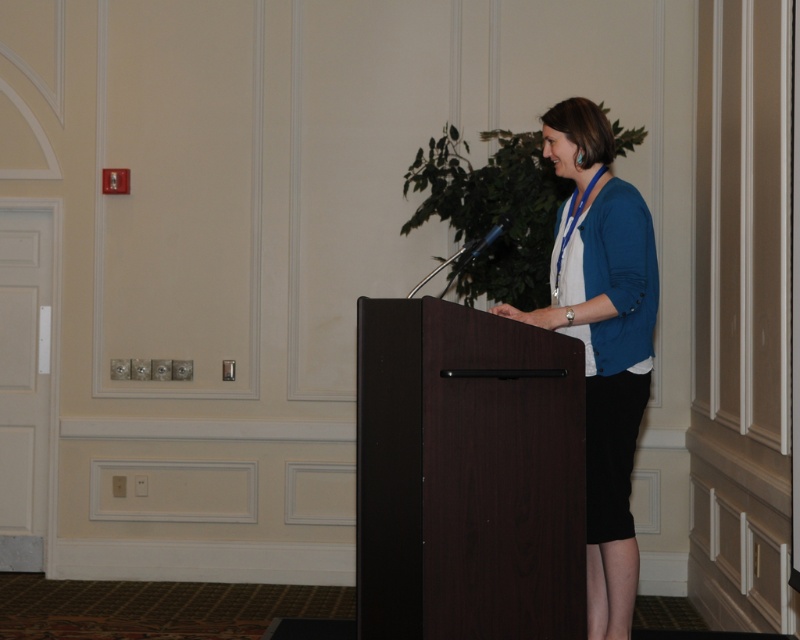
Between point (562, 573) and point (598, 120), which one is positioned in front?

Point (562, 573) is in front.

Looking at this image, does dark wood podium at center lie in front of blue fabric at center?

Yes.

Identify the location of dark wood podium at center. (466, 476).